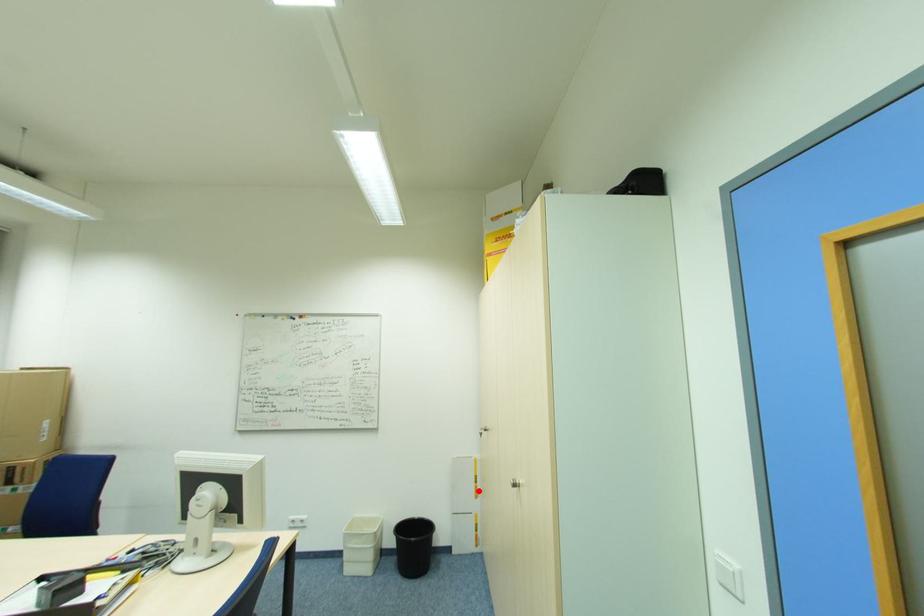
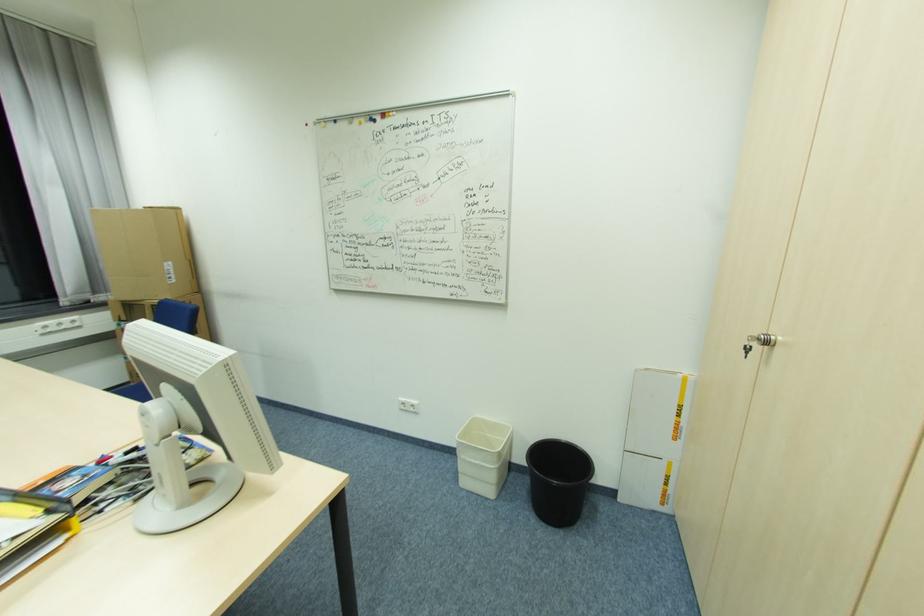
Question: I am providing you with two images of the same scene from different viewpoints. A red point is marked on the first image. Can you still see the location of the red point in image 2?

Choices:
 (A) Yes
 (B) No

Answer: (A)